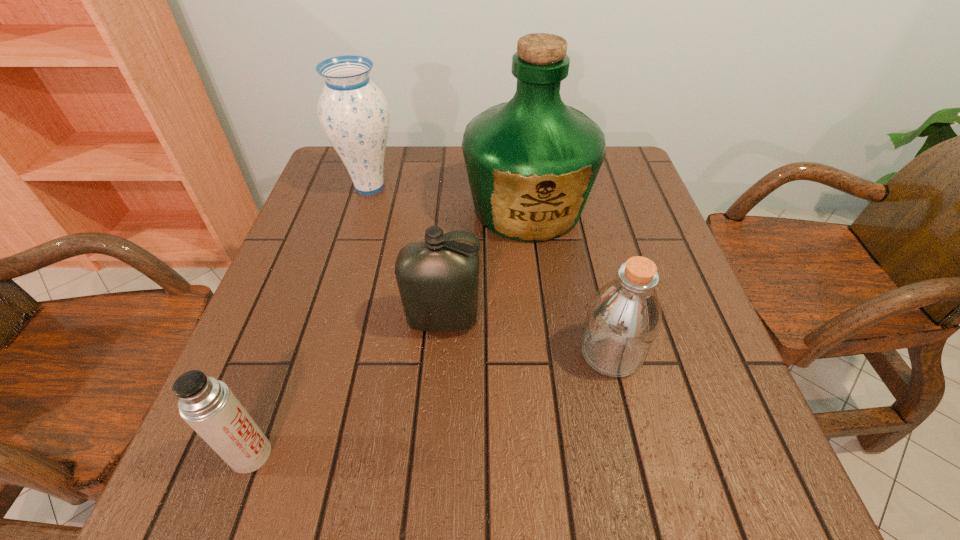
Where is `free space between the thermos bottle and the vase`? free space between the thermos bottle and the vase is located at coordinates (310, 321).

Locate an element on the screen. free point between the tallest object and the nearest object is located at coordinates (389, 332).

Where is `free space between the left bottle and the nearest object`? This screenshot has width=960, height=540. free space between the left bottle and the nearest object is located at coordinates (347, 388).

Where is `object that stands as the closest to the right bottle`? Image resolution: width=960 pixels, height=540 pixels. object that stands as the closest to the right bottle is located at coordinates (438, 278).

Locate which object is the third closest to the thermos bottle. Please provide its 2D coordinates. Your answer should be formatted as a tuple, i.e. [(x, y)], where the tuple contains the x and y coordinates of a point satisfying the conditions above.

[(531, 162)]

Identify the location of free point that satisfies the following two spatial constraints: 1. on the back side of the fourth shortest object; 2. on the left side of the thermos bottle. (348, 187).

This screenshot has width=960, height=540. In order to click on blank area in the image that satisfies the following two spatial constraints: 1. on the label side of the liquor; 2. on the right side of the right bottle in this screenshot , I will do `click(544, 353)`.

At what (x,y) coordinates should I click in order to perform the action: click on blank area in the image that satisfies the following two spatial constraints: 1. on the label side of the right bottle; 2. on the left side of the tallest object. Please return your answer as a coordinate pair (x, y). Looking at the image, I should click on (544, 353).